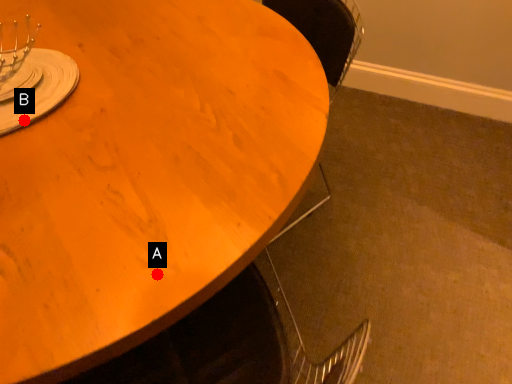
Question: Two points are circled on the image, labeled by A and B beside each circle. Which point is farther from the camera taking this photo?

Choices:
 (A) A is further
 (B) B is further

Answer: (B)